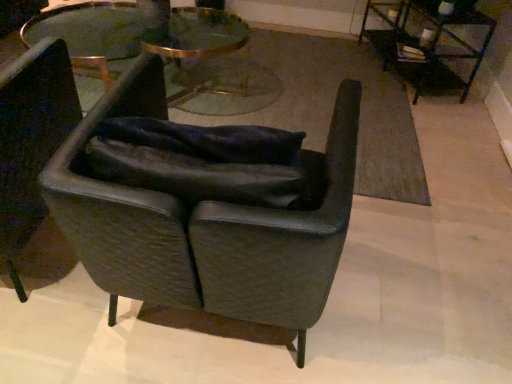
Question: Which direction should I rotate to look at leather armchair at center, the 1th chair when ordered from right to left, — up or down?

Choices:
 (A) up
 (B) down

Answer: (B)

Question: Can you confirm if metallic black table at upper right, the 1th table viewed from the right, is positioned to the left of leather armchair at center, which is the 2th chair in left-to-right order?

Choices:
 (A) yes
 (B) no

Answer: (B)

Question: Is metallic black table at upper right, the 1th table viewed from the right, completely or partially outside of leather armchair at center, the 1th chair when ordered from right to left?

Choices:
 (A) no
 (B) yes

Answer: (B)

Question: Is metallic black table at upper right, the 1th table viewed from the right, not near leather armchair at center, the 1th chair when ordered from right to left?

Choices:
 (A) no
 (B) yes

Answer: (B)

Question: Is the position of metallic black table at upper right, which ranks as the second table in left-to-right order, less distant than that of leather armchair at center, the 1th chair when ordered from right to left?

Choices:
 (A) no
 (B) yes

Answer: (A)

Question: Are metallic black table at upper right, which ranks as the second table in left-to-right order, and leather armchair at center, the 1th chair when ordered from right to left, beside each other?

Choices:
 (A) no
 (B) yes

Answer: (A)

Question: Is leather armchair at center, which is the 2th chair in left-to-right order, located within metallic black table at upper right, the 1th table viewed from the right?

Choices:
 (A) no
 (B) yes

Answer: (A)

Question: Is metallic black table at upper right, which ranks as the second table in left-to-right order, inside clear glass table at center, the second table from the right?

Choices:
 (A) yes
 (B) no

Answer: (B)

Question: Is clear glass table at center, the second table from the right, not near metallic black table at upper right, which ranks as the second table in left-to-right order?

Choices:
 (A) no
 (B) yes

Answer: (B)

Question: From the image's perspective, would you say clear glass table at center, the first table in the left-to-right sequence, is positioned over metallic black table at upper right, the 1th table viewed from the right?

Choices:
 (A) no
 (B) yes

Answer: (A)

Question: Does clear glass table at center, the second table from the right, turn towards metallic black table at upper right, which ranks as the second table in left-to-right order?

Choices:
 (A) no
 (B) yes

Answer: (A)

Question: From the image's perspective, is clear glass table at center, the first table in the left-to-right sequence, beneath metallic black table at upper right, the 1th table viewed from the right?

Choices:
 (A) yes
 (B) no

Answer: (A)

Question: From a real-world perspective, is clear glass table at center, the first table in the left-to-right sequence, under metallic black table at upper right, the 1th table viewed from the right?

Choices:
 (A) yes
 (B) no

Answer: (A)

Question: Would you consider clear glass table at center, the first table in the left-to-right sequence, to be distant from leather armchair at center, the 1th chair when ordered from right to left?

Choices:
 (A) yes
 (B) no

Answer: (A)